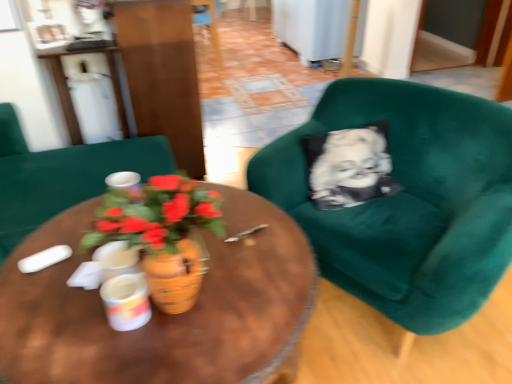
Question: Is white glossy coffee cup at center, which is the first coffee cup in bottom-to-top order, looking in the opposite direction of matte green armchair at center, the 2th chair positioned from the bottom?

Choices:
 (A) yes
 (B) no

Answer: (B)

Question: Is white glossy coffee cup at center, placed as the first coffee cup when sorted from front to back, positioned behind matte green armchair at center, the 2th chair positioned from the bottom?

Choices:
 (A) yes
 (B) no

Answer: (B)

Question: Is white glossy coffee cup at center, which appears as the second coffee cup when viewed from the left, taller than matte green armchair at center, the second chair viewed from the back?

Choices:
 (A) yes
 (B) no

Answer: (B)

Question: Is white glossy coffee cup at center, placed as the 1th coffee cup when sorted from right to left, positioned beyond the bounds of matte green armchair at center, which ranks as the third chair in right-to-left order?

Choices:
 (A) no
 (B) yes

Answer: (B)

Question: Considering the relative sizes of white glossy coffee cup at center, the second coffee cup positioned from the back, and matte green armchair at center, the 2th chair positioned from the bottom, in the image provided, is white glossy coffee cup at center, the second coffee cup positioned from the back, bigger than matte green armchair at center, the 2th chair positioned from the bottom,?

Choices:
 (A) yes
 (B) no

Answer: (B)

Question: Is the depth of white glossy coffee cup at center, placed as the 1th coffee cup when sorted from right to left, less than that of matte green armchair at center, which ranks as the third chair in right-to-left order?

Choices:
 (A) no
 (B) yes

Answer: (B)

Question: From the image's perspective, is velvet green armchair at right, arranged as the 3th chair when viewed from the left, on matte green armchair at center, acting as the 2th chair starting from the top?

Choices:
 (A) yes
 (B) no

Answer: (B)

Question: Could you tell me if velvet green armchair at right, which is the 1th chair from front to back, is turned towards matte green armchair at center, which ranks as the third chair in right-to-left order?

Choices:
 (A) yes
 (B) no

Answer: (B)

Question: Does velvet green armchair at right, the 1th chair when ordered from right to left, come in front of matte green armchair at center, the 2th chair positioned from the bottom?

Choices:
 (A) yes
 (B) no

Answer: (A)

Question: Is velvet green armchair at right, the 3th chair in the back-to-front sequence, completely or partially outside of matte green armchair at center, the second chair viewed from the back?

Choices:
 (A) no
 (B) yes

Answer: (B)

Question: Is velvet green armchair at right, the 3th chair in the back-to-front sequence, bigger than matte green armchair at center, which ranks as the third chair in right-to-left order?

Choices:
 (A) no
 (B) yes

Answer: (A)

Question: Is velvet green armchair at right, the third chair viewed from the top, with matte green armchair at center, acting as the 2th chair starting from the top?

Choices:
 (A) no
 (B) yes

Answer: (A)

Question: Can you confirm if terracotta pot at center is smaller than white glossy coffee cup at center, which appears as the second coffee cup when viewed from the left?

Choices:
 (A) no
 (B) yes

Answer: (A)